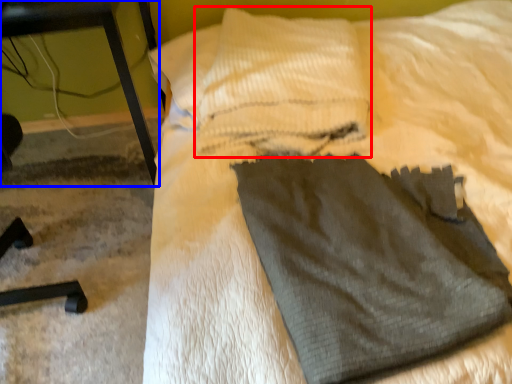
Question: Which point is closer to the camera, pillow (highlighted by a red box) or furniture (highlighted by a blue box)?

Choices:
 (A) pillow
 (B) furniture

Answer: (B)